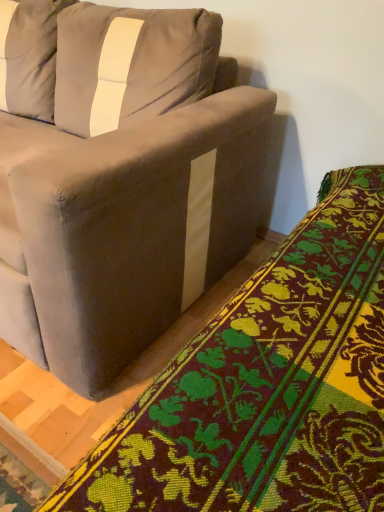
Question: Should I look upward or downward to see suede-like gray couch at upper left?

Choices:
 (A) down
 (B) up

Answer: (B)

Question: Is velvet-like green and yellow floral blanket at lower right next to suede-like gray couch at upper left?

Choices:
 (A) yes
 (B) no

Answer: (B)

Question: Can you confirm if velvet-like green and yellow floral blanket at lower right is positioned to the left of suede-like gray couch at upper left?

Choices:
 (A) yes
 (B) no

Answer: (B)

Question: Could suede-like gray couch at upper left be considered to be inside velvet-like green and yellow floral blanket at lower right?

Choices:
 (A) yes
 (B) no

Answer: (B)

Question: Does velvet-like green and yellow floral blanket at lower right have a greater width compared to suede-like gray couch at upper left?

Choices:
 (A) yes
 (B) no

Answer: (B)

Question: Does velvet-like green and yellow floral blanket at lower right appear on the right side of suede-like gray couch at upper left?

Choices:
 (A) no
 (B) yes

Answer: (B)

Question: From a real-world perspective, is velvet-like green and yellow floral blanket at lower right physically above suede-like gray couch at upper left?

Choices:
 (A) no
 (B) yes

Answer: (B)

Question: Is suede-like gray couch at upper left wider than velvet-like green and yellow floral blanket at lower right?

Choices:
 (A) no
 (B) yes

Answer: (B)

Question: From a real-world perspective, is suede-like gray couch at upper left located beneath velvet-like green and yellow floral blanket at lower right?

Choices:
 (A) no
 (B) yes

Answer: (B)

Question: Can you confirm if suede-like gray couch at upper left is bigger than velvet-like green and yellow floral blanket at lower right?

Choices:
 (A) no
 (B) yes

Answer: (B)

Question: Is suede-like gray couch at upper left touching velvet-like green and yellow floral blanket at lower right?

Choices:
 (A) no
 (B) yes

Answer: (A)

Question: From a real-world perspective, is suede-like gray couch at upper left on top of velvet-like green and yellow floral blanket at lower right?

Choices:
 (A) yes
 (B) no

Answer: (B)

Question: Is suede-like gray couch at upper left outside velvet-like green and yellow floral blanket at lower right?

Choices:
 (A) yes
 (B) no

Answer: (A)

Question: Considering the relative positions of suede-like gray couch at upper left and velvet-like green and yellow floral blanket at lower right in the image provided, is suede-like gray couch at upper left to the left or to the right of velvet-like green and yellow floral blanket at lower right?

Choices:
 (A) left
 (B) right

Answer: (A)